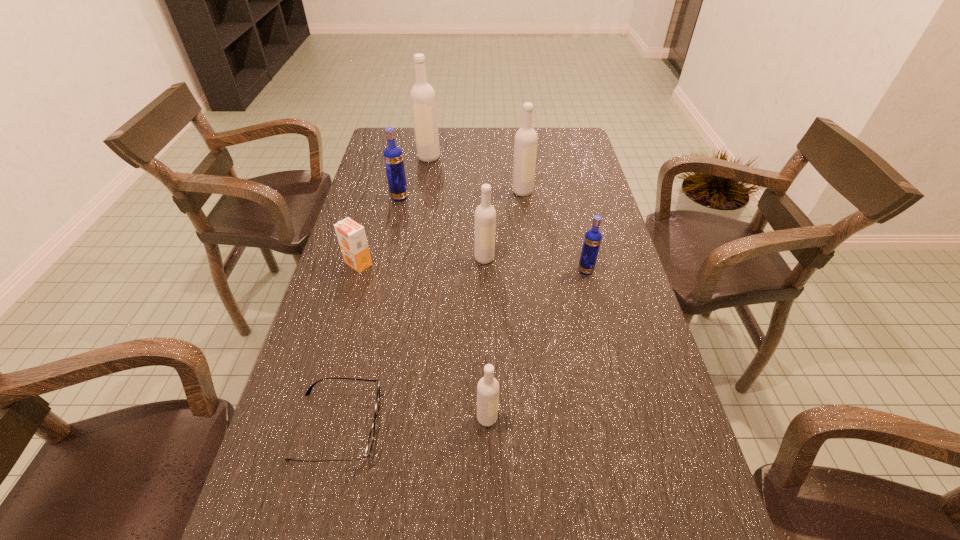
This screenshot has height=540, width=960. In order to click on free space located on the back of the orange juice in this screenshot , I will do `click(372, 218)`.

At what (x,y) coordinates should I click in order to perform the action: click on blank space located 0.140m on the front-facing side of the spectacles. Please return your answer as a coordinate pair (x, y). The image size is (960, 540). Looking at the image, I should click on pyautogui.click(x=448, y=426).

Where is `object at the far edge`? The image size is (960, 540). object at the far edge is located at coordinates (423, 100).

This screenshot has width=960, height=540. I want to click on vodka at the left edge, so click(x=393, y=156).

Find the location of `orange juice that is at the left edge`. orange juice that is at the left edge is located at coordinates (351, 236).

Image resolution: width=960 pixels, height=540 pixels. Find the location of `spectacles present at the left edge`. spectacles present at the left edge is located at coordinates (372, 433).

Identify the location of object that is at the right edge. This screenshot has height=540, width=960. (592, 240).

In the image, there is a desktop. Identify the location of free space at the far edge. (491, 129).

Identify the location of vacant space at the left edge. The width and height of the screenshot is (960, 540). (376, 171).

The height and width of the screenshot is (540, 960). What are the coordinates of `vacant region at the right edge of the desktop` in the screenshot? It's located at (588, 164).